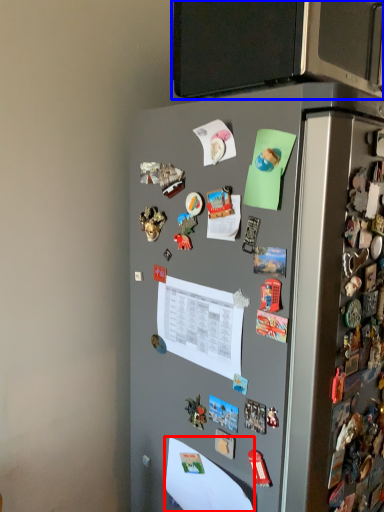
Question: Which point is further to the camera, paper (highlighted by a red box) or back (highlighted by a blue box)?

Choices:
 (A) paper
 (B) back

Answer: (A)